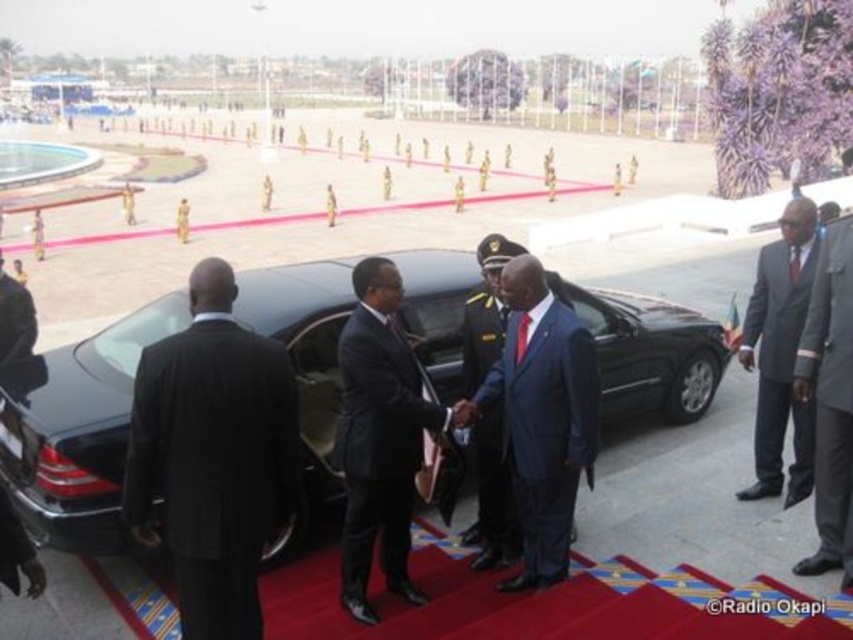
Question: Estimate the real-world distances between objects in this image. Which object is closer to the dark blue satin suit at center?

Choices:
 (A) gray woolen suit at right
 (B) dark blue suit at center
 (C) dark blue suit at right

Answer: (B)

Question: Among these objects, which one is farthest from the camera?

Choices:
 (A) dark blue suit at right
 (B) gray woolen suit at right
 (C) blue glossy suit at center
 (D) black suit at center

Answer: (A)

Question: Does blue glossy suit at center have a greater width compared to dark blue satin suit at center?

Choices:
 (A) yes
 (B) no

Answer: (A)

Question: Observing the image, what is the correct spatial positioning of black suit at center in reference to gray woolen suit at right?

Choices:
 (A) right
 (B) left

Answer: (B)

Question: Is black suit at center further to the viewer compared to dark blue suit at right?

Choices:
 (A) yes
 (B) no

Answer: (B)

Question: Which of the following is the closest to the observer?

Choices:
 (A) (467, 380)
 (B) (560, 499)
 (C) (21, 500)
 (D) (798, 304)

Answer: (C)